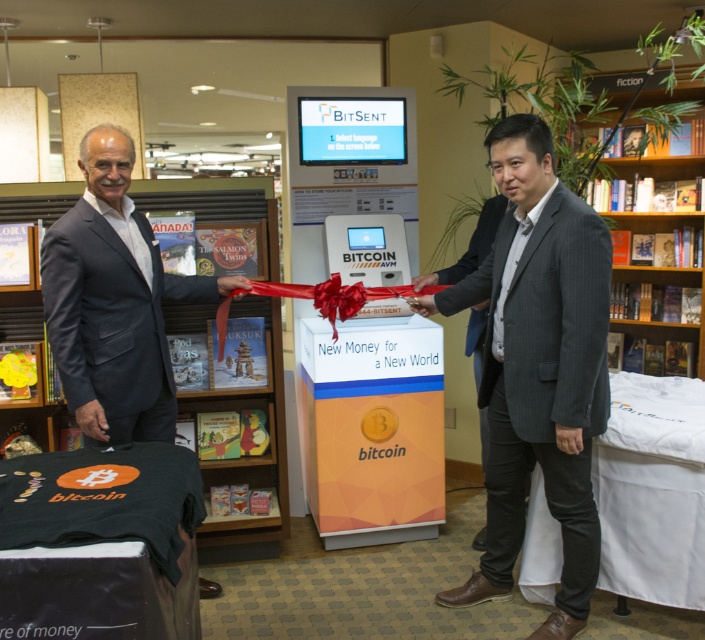
Question: Is wooden bookshelf at upper right bigger than red silk ribbon at center?

Choices:
 (A) yes
 (B) no

Answer: (A)

Question: Among these points, which one is nearest to the camera?

Choices:
 (A) (575, 554)
 (B) (337, 314)

Answer: (A)

Question: Can you confirm if wooden bookshelf at upper right is positioned to the right of red silk ribbon at center?

Choices:
 (A) no
 (B) yes

Answer: (B)

Question: Does gray wool suit at center have a smaller size compared to wooden bookshelf at upper right?

Choices:
 (A) yes
 (B) no

Answer: (B)

Question: Which point is farther to the camera?

Choices:
 (A) (658, 269)
 (B) (448, 285)
 (C) (97, 300)
 (D) (525, 209)

Answer: (A)

Question: Among these objects, which one is nearest to the camera?

Choices:
 (A) gray wool suit at center
 (B) black suit at left
 (C) red silk ribbon at center
 (D) wooden bookshelf at upper right

Answer: (A)